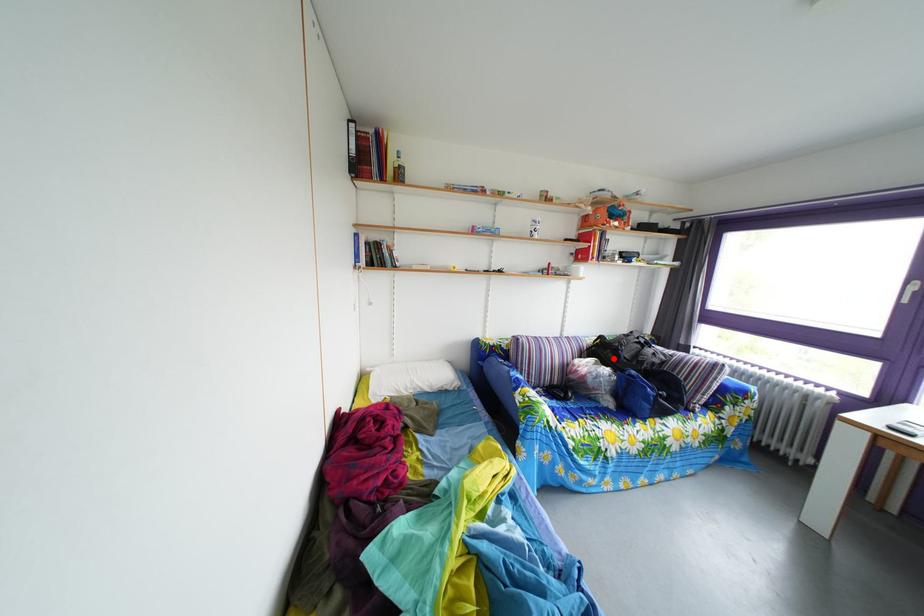
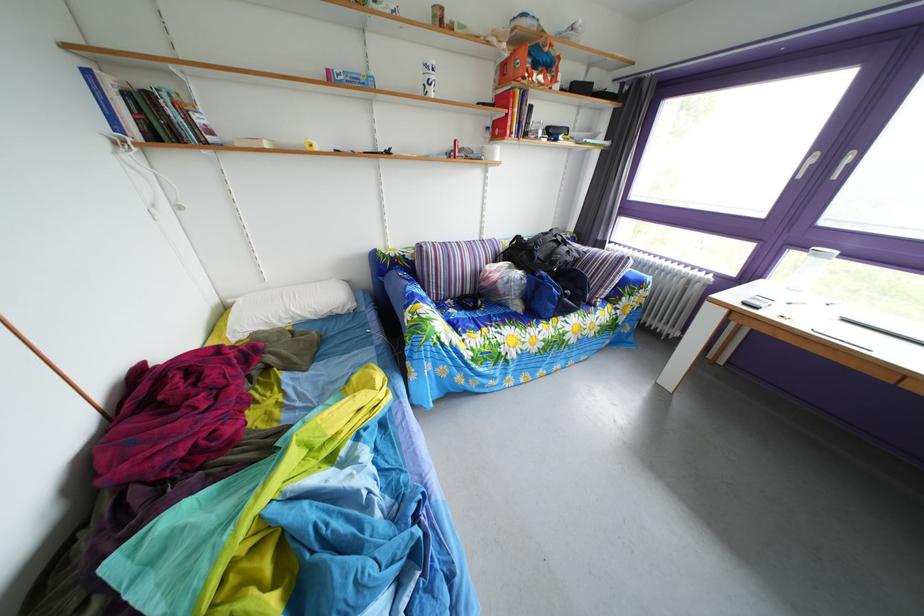
Locate, in the second image, the point that corresponds to the highlighted location in the first image.

(529, 261)